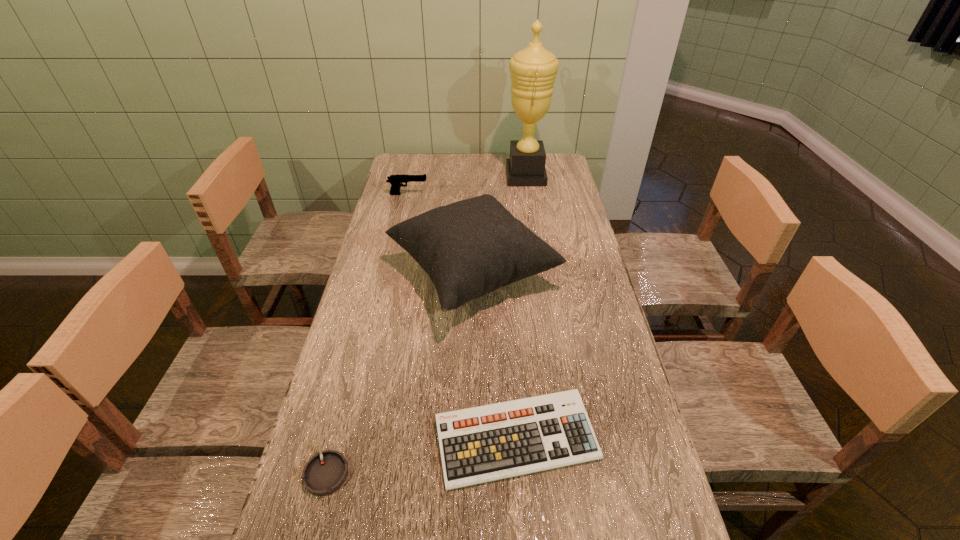
The width and height of the screenshot is (960, 540). Identify the location of cushion that is at the right edge. (471, 247).

Locate an element on the screen. computer keyboard located in the right edge section of the desktop is located at coordinates (491, 442).

Where is `object that is at the far right corner`? Image resolution: width=960 pixels, height=540 pixels. object that is at the far right corner is located at coordinates (533, 70).

In the image, there is a desktop. Identify the location of free space at the far edge. The width and height of the screenshot is (960, 540). (500, 164).

Image resolution: width=960 pixels, height=540 pixels. I want to click on vacant space at the left edge of the desktop, so click(x=396, y=258).

Locate an element on the screen. Image resolution: width=960 pixels, height=540 pixels. vacant area at the right edge is located at coordinates (568, 234).

Where is `free space between the cushion and the shortest object`? free space between the cushion and the shortest object is located at coordinates (399, 373).

Image resolution: width=960 pixels, height=540 pixels. Identify the location of vacant area between the trophy cup and the fourth nearest object. (467, 185).

The width and height of the screenshot is (960, 540). I want to click on vacant area that lies between the third nearest object and the computer keyboard, so click(494, 356).

Identify which object is the second nearest to the shortest object. Please provide its 2D coordinates. Your answer should be formatted as a tuple, i.e. [(x, y)], where the tuple contains the x and y coordinates of a point satisfying the conditions above.

[(471, 247)]